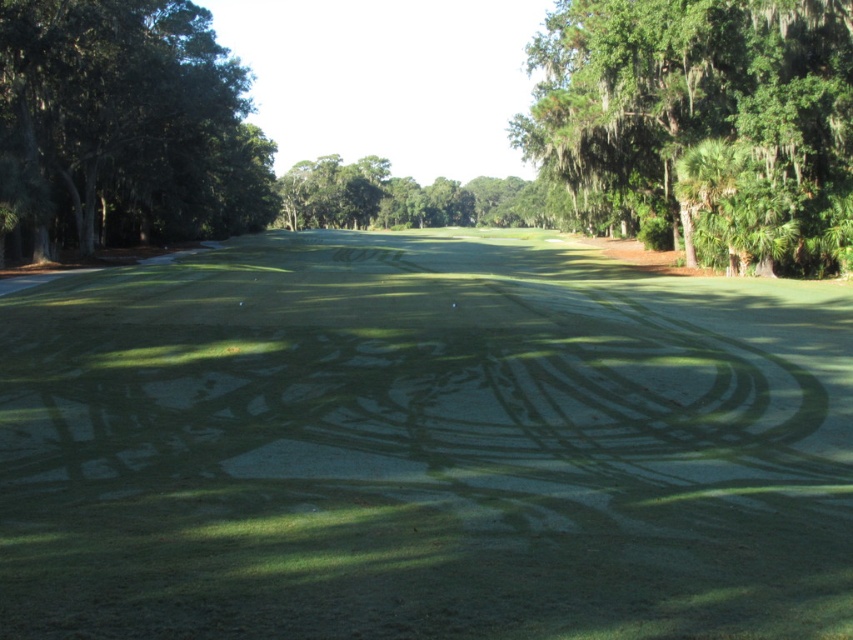
You are a golfer standing on the green smooth turf at center and want to hit a ball towards the green leafy tree at left. Considering the spatial relationship between these two objects, will you have to aim upwards or downwards to reach your target?

The green smooth turf at center is closer to the viewer than the green leafy tree at left, so you will need to aim upwards to reach the green leafy tree at left.

You are a golfer standing on the putting green and want to determine the location of the green leafy tree at upper right. Based on the coordinates provided, where would you find the tree relative to your position?

The green leafy tree at upper right is located at coordinates point (701, 122), which places it in the upper right corner of the scene relative to your position on the putting green.

You are a golfer preparing to putt on the green smooth turf at center. You notice the green leafy tree at left casting a shadow over part of the putting surface. Based on the scene, which object takes up more area on the image?

The green leafy tree at left takes up more area on the image than the green smooth turf at center, as the green smooth turf at center occupies less space than the green leafy tree at left.